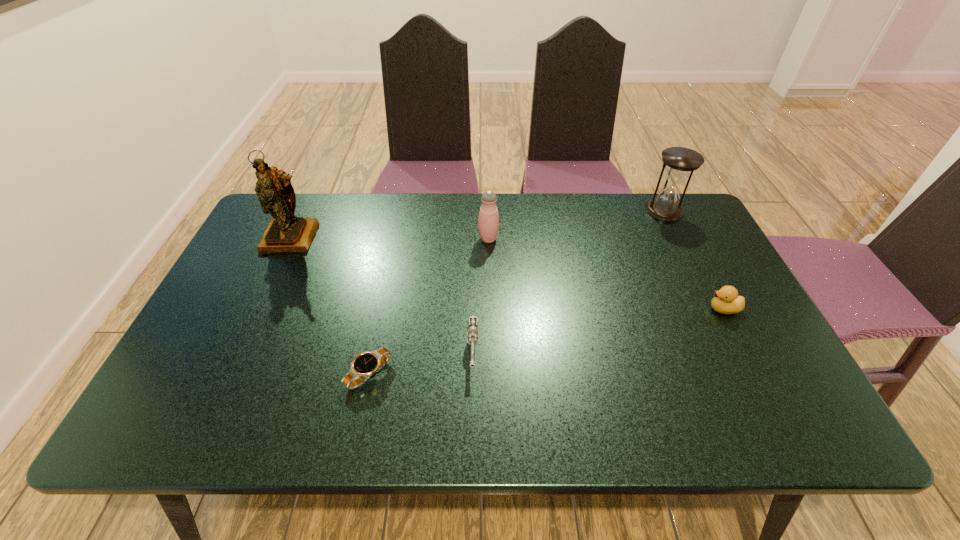
Point out which object is positioned as the nearest to the duckling. Please provide its 2D coordinates. Your answer should be formatted as a tuple, i.e. [(x, y)], where the tuple contains the x and y coordinates of a point satisfying the conditions above.

[(680, 162)]

Identify the location of vacant region that satisfies the following two spatial constraints: 1. on the front-facing side of the leftmost object; 2. on the left side of the thermos bottle. The image size is (960, 540). (291, 239).